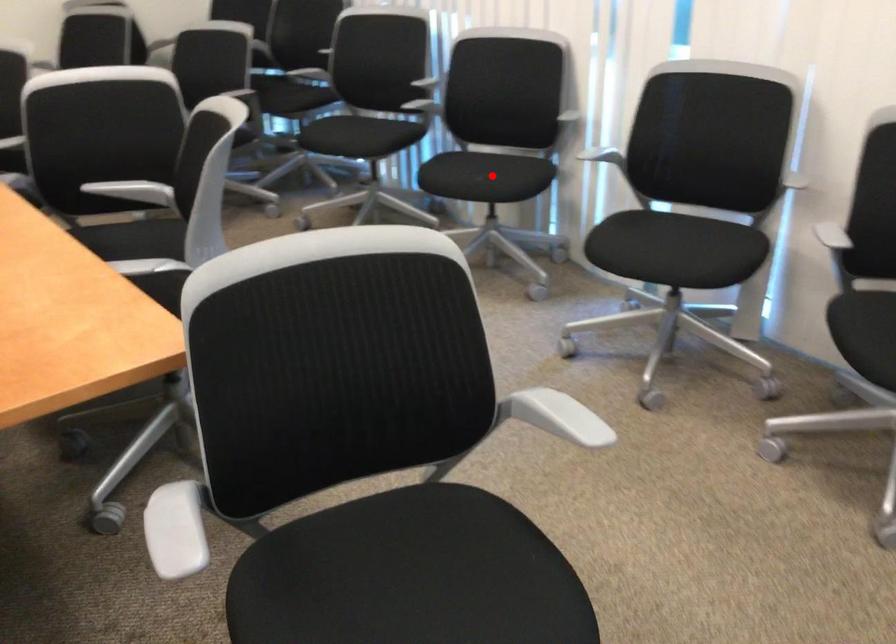
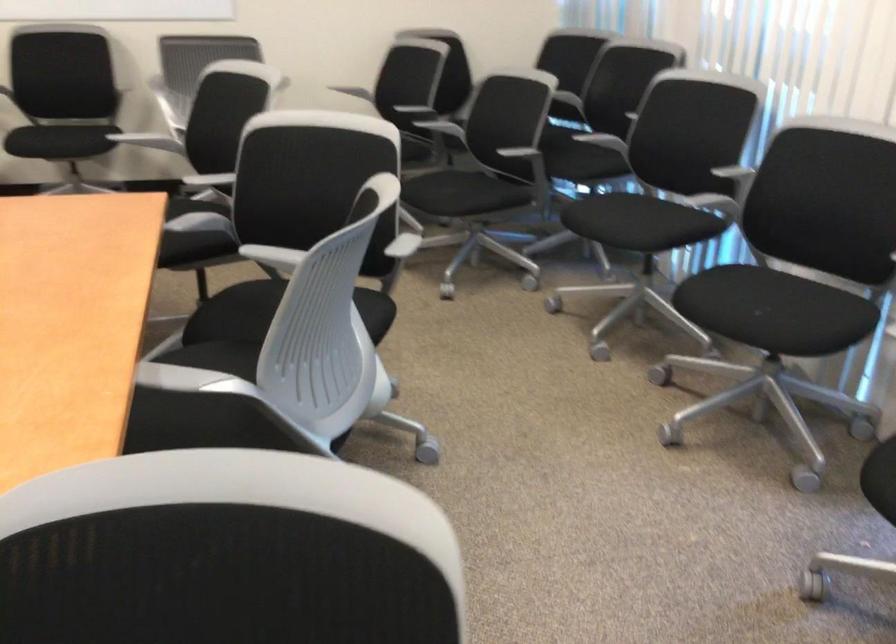
Question: A red point is marked in image1. In image2, is the corresponding 3D point closer to the camera or farther? Reply with the corresponding letter.

Choices:
 (A) The corresponding 3D point is closer.
 (B) The corresponding 3D point is farther.

Answer: (A)